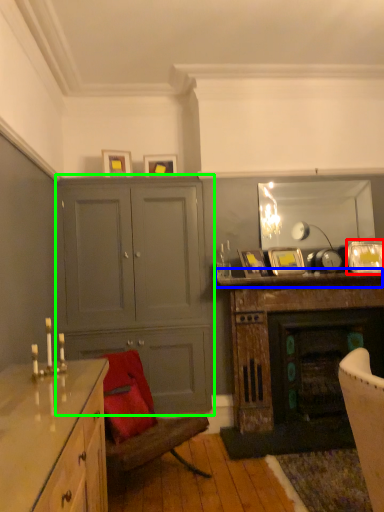
Question: Considering the real-world distances, which object is closest to picture frame (highlighted by a red box)? mantle (highlighted by a blue box) or cabinetry (highlighted by a green box).

Choices:
 (A) mantle
 (B) cabinetry

Answer: (A)